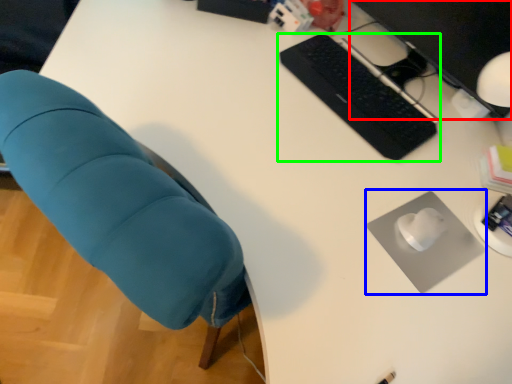
Question: Estimate the real-world distances between objects in this image. Which object is closer to computer monitor (highlighted by a red box), mousepad (highlighted by a blue box) or computer keyboard (highlighted by a green box)?

Choices:
 (A) mousepad
 (B) computer keyboard

Answer: (B)